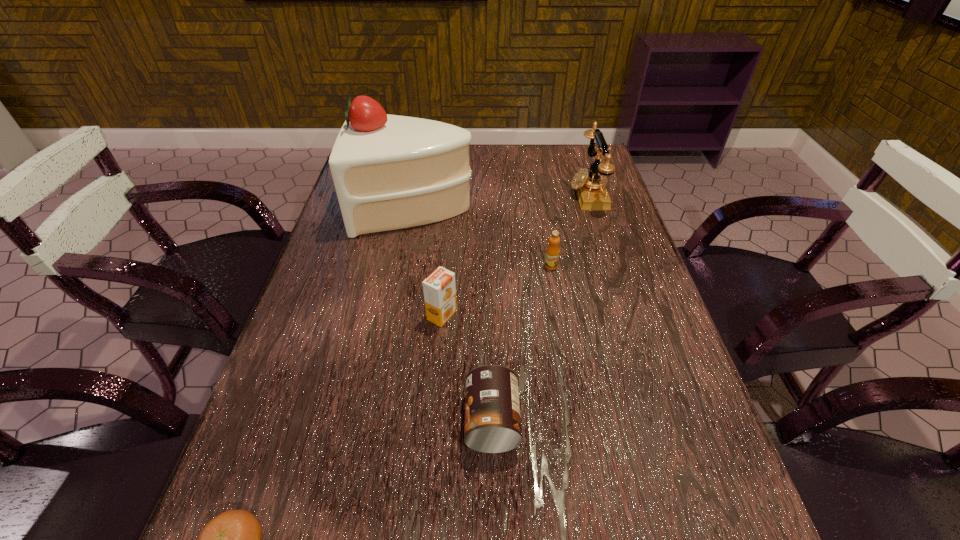
You are a GUI agent. You are given a task and a screenshot of the screen. Output one action in this format:
    pyautogui.click(x=<x>, y=<y>)
    Task: Click on the vacant area that lies between the second nearest object and the tallest object
    
    Given the screenshot: What is the action you would take?
    pyautogui.click(x=453, y=315)

The height and width of the screenshot is (540, 960). Identify the location of unoccupied area between the fourth nearest object and the fifth shortest object. (569, 230).

Where is `free space between the second object from right to left and the telephone`? The height and width of the screenshot is (540, 960). free space between the second object from right to left and the telephone is located at coordinates (569, 230).

This screenshot has height=540, width=960. In order to click on unoccupied area between the can and the farther orange juice in this screenshot , I will do `click(521, 343)`.

Image resolution: width=960 pixels, height=540 pixels. I want to click on the second closest object relative to the nearer orange juice, so click(390, 172).

Choose which object is the fifth nearest neighbor to the shortest object. Please provide its 2D coordinates. Your answer should be formatted as a tuple, i.e. [(x, y)], where the tuple contains the x and y coordinates of a point satisfying the conditions above.

[(591, 192)]

Where is `vacant area that satisfies the following two spatial constraints: 1. on the dial of the telephone; 2. on the front side of the nearer orange juice`? vacant area that satisfies the following two spatial constraints: 1. on the dial of the telephone; 2. on the front side of the nearer orange juice is located at coordinates (626, 315).

What are the coordinates of `free point that satisfies the following two spatial constraints: 1. on the dial of the second tallest object; 2. on the front side of the cake` in the screenshot? It's located at [x=592, y=208].